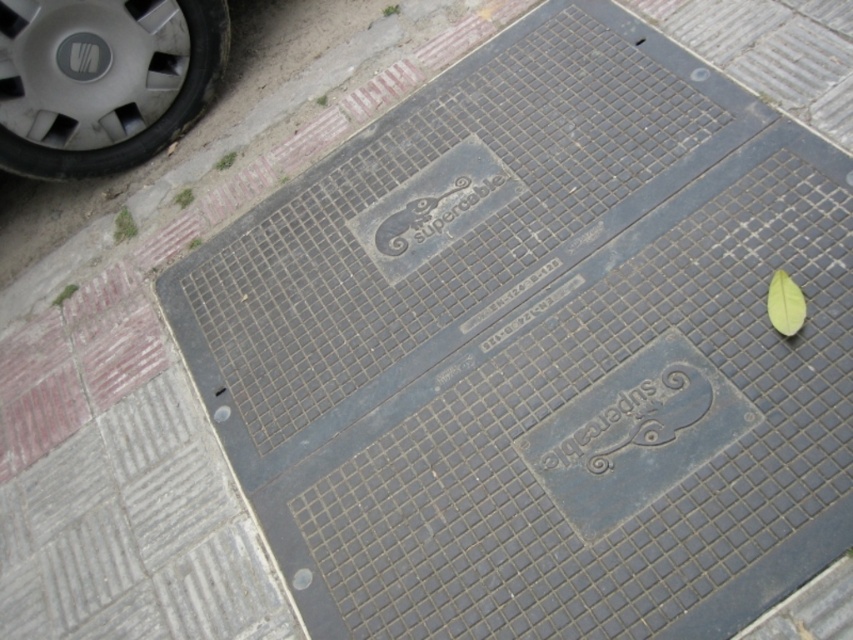
Is metallic gray tire at upper left wider than green matte leaf at upper right?

Correct, the width of metallic gray tire at upper left exceeds that of green matte leaf at upper right.

Is metallic gray tire at upper left taller than green matte leaf at upper right?

Yes, metallic gray tire at upper left is taller than green matte leaf at upper right.

Does point (140, 8) come behind point (772, 284)?

Yes, it is.

The image size is (853, 640). I want to click on metallic gray tire at upper left, so click(x=103, y=81).